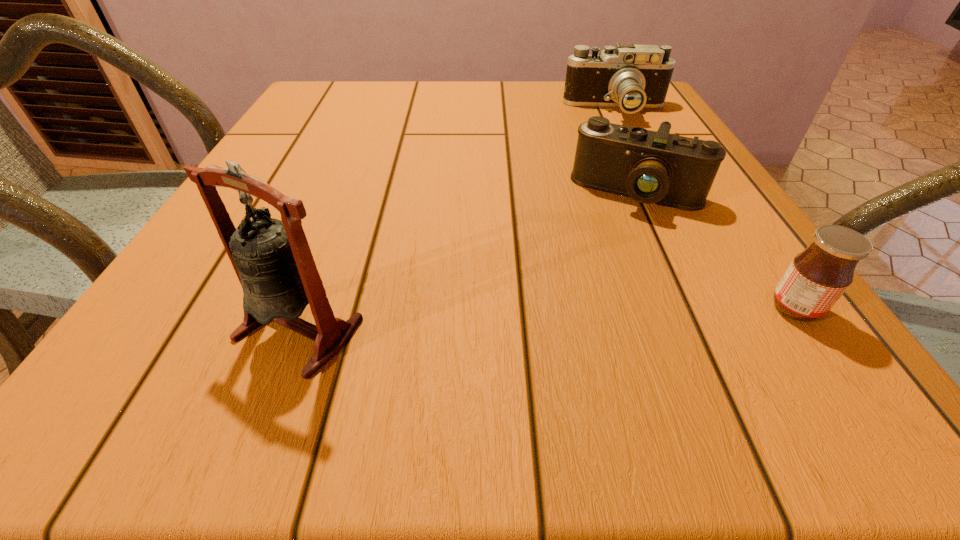
The width and height of the screenshot is (960, 540). Find the location of `free space that satisfies the following two spatial constraints: 1. on the front side of the jam; 2. on the label side of the third nearest object`. free space that satisfies the following two spatial constraints: 1. on the front side of the jam; 2. on the label side of the third nearest object is located at coordinates (689, 308).

Find the location of a particular element. Image resolution: width=960 pixels, height=540 pixels. vacant region that satisfies the following two spatial constraints: 1. on the front side of the jam; 2. on the label side of the farthest object is located at coordinates (720, 308).

This screenshot has width=960, height=540. I want to click on free space that satisfies the following two spatial constraints: 1. on the front side of the jam; 2. on the label side of the farther camera, so click(720, 308).

At what (x,y) coordinates should I click in order to perform the action: click on blank space that satisfies the following two spatial constraints: 1. on the front side of the jam; 2. on the label side of the nearer camera. Please return your answer as a coordinate pair (x, y). Looking at the image, I should click on (689, 308).

The height and width of the screenshot is (540, 960). Find the location of `free space that satisfies the following two spatial constraints: 1. on the front side of the jam; 2. on the label side of the nearer camera`. free space that satisfies the following two spatial constraints: 1. on the front side of the jam; 2. on the label side of the nearer camera is located at coordinates (689, 308).